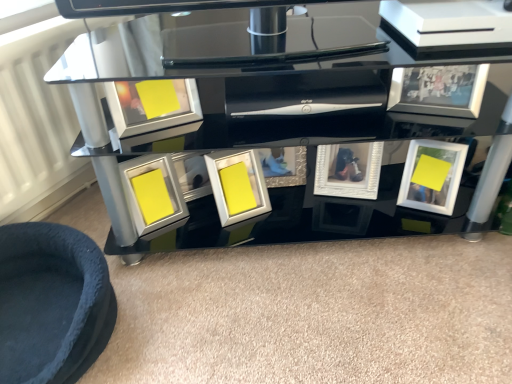
You are a GUI agent. You are given a task and a screenshot of the screen. Output one action in this format:
    pyautogui.click(x=<x>, y=<y>)
    Task: Click on the free space in front of white glossy picture frame at center, arranged as the third picture frame when viewed from the left
    Image resolution: width=512 pixels, height=384 pixels.
    Given the screenshot: What is the action you would take?
    pyautogui.click(x=221, y=276)